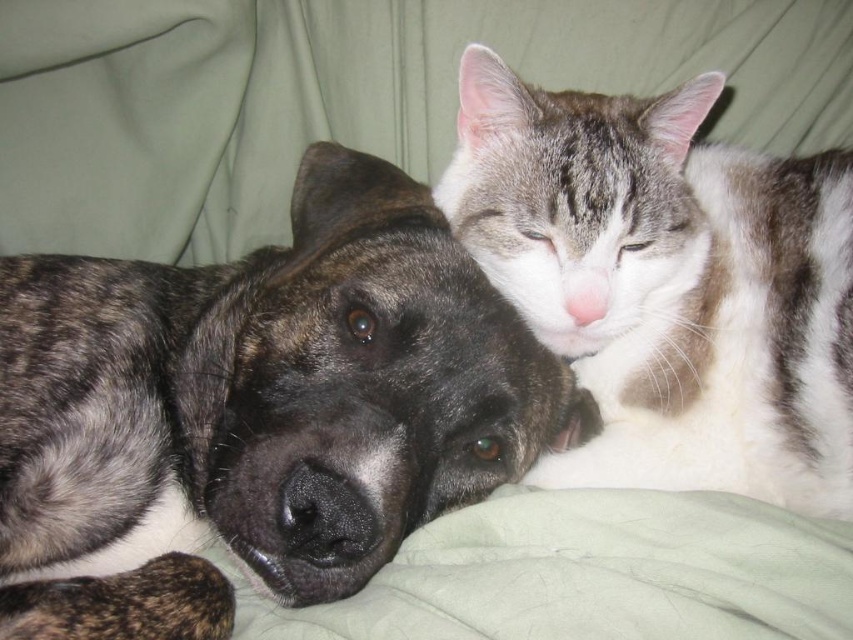
Question: Considering the relative positions of brindle fur dog at center and gray and white fur cat at upper right in the image provided, where is brindle fur dog at center located with respect to gray and white fur cat at upper right?

Choices:
 (A) right
 (B) left

Answer: (B)

Question: Is brindle fur dog at center above gray and white fur cat at upper right?

Choices:
 (A) no
 (B) yes

Answer: (A)

Question: Is brindle fur dog at center wider than gray and white fur cat at upper right?

Choices:
 (A) yes
 (B) no

Answer: (A)

Question: Among these points, which one is nearest to the camera?

Choices:
 (A) (680, 220)
 (B) (497, 424)

Answer: (B)

Question: Among these objects, which one is farthest from the camera?

Choices:
 (A) gray and white fur cat at upper right
 (B) brindle fur dog at center

Answer: (A)